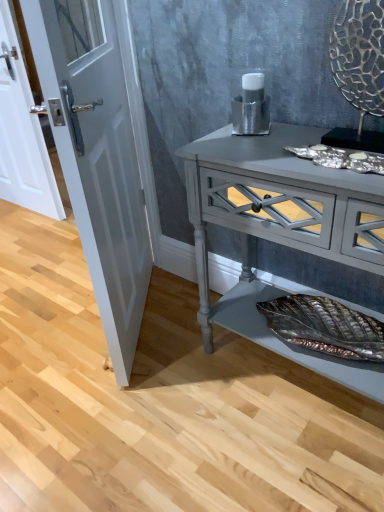
The width and height of the screenshot is (384, 512). In order to click on white glossy door at left, the 1th door in the back-to-front sequence in this screenshot , I will do [22, 133].

The width and height of the screenshot is (384, 512). What are the coordinates of `matte gray console table at center` in the screenshot? It's located at (280, 229).

Looking at this image, is the position of white glossy door at left, which is the second door in right-to-left order, more distant than that of matte gray console table at center?

Yes, white glossy door at left, which is the second door in right-to-left order, is further from the viewer.

Who is smaller, white glossy door at left, arranged as the second door when viewed from the front, or matte gray console table at center?

white glossy door at left, arranged as the second door when viewed from the front, is smaller.

Starting from the matte gray console table at center, which door is the 2nd one behind? Please provide its 2D coordinates.

[(22, 133)]

Would you say white glossy door at left, the 1th door in the back-to-front sequence, is outside matte gray console table at center?

Absolutely, white glossy door at left, the 1th door in the back-to-front sequence, is external to matte gray console table at center.

From a real-world perspective, which is physically below, white glossy door at left, arranged as the first door when viewed from the right, or matte gray console table at center?

From a 3D spatial view, matte gray console table at center is below.

Looking at the image, does white glossy door at left, which is counted as the 1th door, starting from the front, seem bigger or smaller compared to matte gray console table at center?

In the image, white glossy door at left, which is counted as the 1th door, starting from the front, appears to be smaller than matte gray console table at center.

Does white glossy door at left, which is counted as the 1th door, starting from the front, have a greater height compared to matte gray console table at center?

Correct, white glossy door at left, which is counted as the 1th door, starting from the front, is much taller as matte gray console table at center.

Is point (88, 154) closer to viewer compared to point (313, 129)?

Yes, it is in front of point (313, 129).

Are matte gray console table at center and white glossy door at left, the 1th door in the back-to-front sequence, located far from each other?

matte gray console table at center is far away from white glossy door at left, the 1th door in the back-to-front sequence.

Looking at this image, from a real-world perspective, is matte gray console table at center on white glossy door at left, which is the second door in right-to-left order?

Incorrect, from a real-world perspective, matte gray console table at center is lower than white glossy door at left, which is the second door in right-to-left order.

Is matte gray console table at center turned away from white glossy door at left, arranged as the second door when viewed from the front?

No, matte gray console table at center is not facing the opposite direction of white glossy door at left, arranged as the second door when viewed from the front.

What's the angular difference between matte gray console table at center and white glossy door at left, the first door positioned from the left,'s facing directions?

The angle between the facing direction of matte gray console table at center and the facing direction of white glossy door at left, the first door positioned from the left, is 0.0045 degrees.

From the image's perspective, which is above, white glossy door at left, arranged as the first door when viewed from the right, or white glossy door at left, the 1th door in the back-to-front sequence?

white glossy door at left, the 1th door in the back-to-front sequence, appears higher in the image.

Can you confirm if white glossy door at left, arranged as the first door when viewed from the right, is shorter than white glossy door at left, which is the second door in right-to-left order?

No, white glossy door at left, arranged as the first door when viewed from the right, is not shorter than white glossy door at left, which is the second door in right-to-left order.

Is white glossy door at left, arranged as the first door when viewed from the right, inside the boundaries of white glossy door at left, which is the second door in right-to-left order, or outside?

white glossy door at left, arranged as the first door when viewed from the right, cannot be found inside white glossy door at left, which is the second door in right-to-left order.

Is matte gray console table at center oriented towards white glossy door at left, acting as the second door starting from the left?

No, matte gray console table at center is not oriented towards white glossy door at left, acting as the second door starting from the left.

Is white glossy door at left, which ranks as the 2th door in back-to-front order, inside matte gray console table at center?

No, white glossy door at left, which ranks as the 2th door in back-to-front order, is located outside of matte gray console table at center.

Which object is thinner, matte gray console table at center or white glossy door at left, arranged as the first door when viewed from the right?

With smaller width is white glossy door at left, arranged as the first door when viewed from the right.

Which object is positioned more to the left, matte gray console table at center or white glossy door at left, which ranks as the 2th door in back-to-front order?

From the viewer's perspective, white glossy door at left, which ranks as the 2th door in back-to-front order, appears more on the left side.

Considering the relative positions of white glossy door at left, which is the second door in right-to-left order, and white glossy door at left, acting as the second door starting from the left, in the image provided, is white glossy door at left, which is the second door in right-to-left order, to the right of white glossy door at left, acting as the second door starting from the left, from the viewer's perspective?

No.

In the scene shown: Could you tell me if white glossy door at left, the 1th door in the back-to-front sequence, is turned towards white glossy door at left, which ranks as the 2th door in back-to-front order?

No, white glossy door at left, the 1th door in the back-to-front sequence, does not turn towards white glossy door at left, which ranks as the 2th door in back-to-front order.

Is white glossy door at left, arranged as the second door when viewed from the front, far away from white glossy door at left, which ranks as the 2th door in back-to-front order?

Absolutely, white glossy door at left, arranged as the second door when viewed from the front, is distant from white glossy door at left, which ranks as the 2th door in back-to-front order.

Which is closer to the camera, (8, 177) or (57, 119)?

Positioned in front is point (57, 119).

The height and width of the screenshot is (512, 384). Find the location of `chest of drawers to the right of white glossy door at left, arranged as the second door when viewed from the front`. chest of drawers to the right of white glossy door at left, arranged as the second door when viewed from the front is located at coordinates (280, 229).

Find the location of a particular element. the 1st door above the matte gray console table at center (from the image's perspective) is located at coordinates (96, 157).

Which object lies further to the anchor point matte gray console table at center, white glossy door at left, arranged as the second door when viewed from the front, or white glossy door at left, acting as the second door starting from the left?

white glossy door at left, arranged as the second door when viewed from the front.

Which object lies further to the anchor point white glossy door at left, the first door positioned from the left, matte gray console table at center or white glossy door at left, acting as the second door starting from the left?

matte gray console table at center lies further to white glossy door at left, the first door positioned from the left, than the other object.

Looking at the image, which one is located closer to white glossy door at left, arranged as the first door when viewed from the right, white glossy door at left, arranged as the second door when viewed from the front, or matte gray console table at center?

matte gray console table at center is positioned closer to the anchor white glossy door at left, arranged as the first door when viewed from the right.

From the image, which object appears to be farther from white glossy door at left, acting as the second door starting from the left, matte gray console table at center or white glossy door at left, which is the second door in right-to-left order?

white glossy door at left, which is the second door in right-to-left order, is positioned further to the anchor white glossy door at left, acting as the second door starting from the left.

From the image, which object appears to be nearer to white glossy door at left, the 1th door in the back-to-front sequence, white glossy door at left, arranged as the first door when viewed from the right, or matte gray console table at center?

white glossy door at left, arranged as the first door when viewed from the right.

Which object lies nearer to the anchor point matte gray console table at center, white glossy door at left, arranged as the first door when viewed from the right, or white glossy door at left, the 1th door in the back-to-front sequence?

white glossy door at left, arranged as the first door when viewed from the right, lies closer to matte gray console table at center than the other object.

The width and height of the screenshot is (384, 512). In order to click on door between white glossy door at left, which is the second door in right-to-left order, and matte gray console table at center from left to right in this screenshot , I will do `click(96, 157)`.